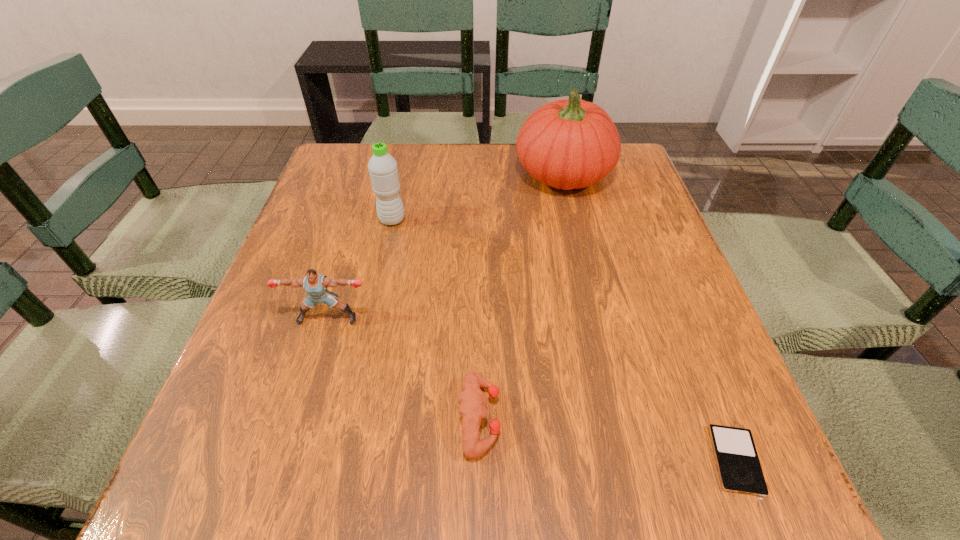
Identify the location of vacant space that satisfies the following two spatial constraints: 1. on the front-facing side of the third tallest object; 2. on the right side of the shortest object. Image resolution: width=960 pixels, height=540 pixels. (284, 460).